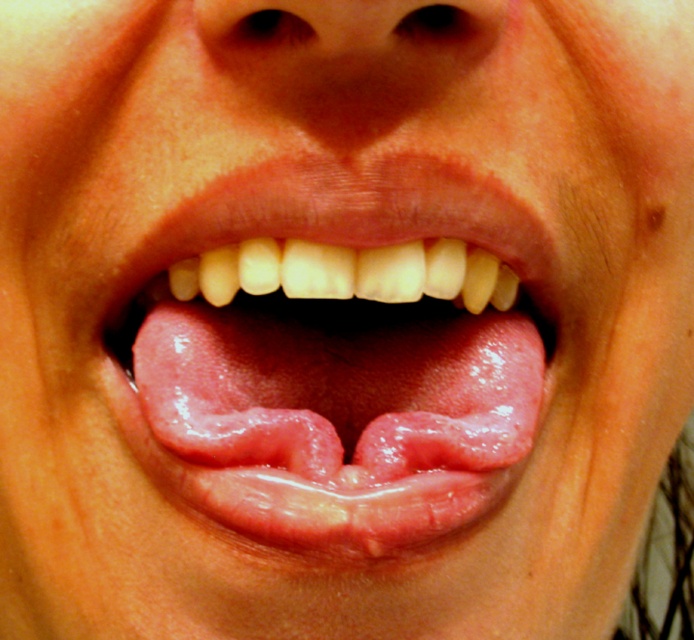
Based on the scene description, which object is positioned lower in the image, the pink flesh tongue at center or the smooth skin at center?

The pink flesh tongue at center is located below smooth skin at center, so the pink flesh tongue at center is positioned lower in the image.

You are a dentist examining a patient. You need to reach a point located at coordinates point [509,396] in the mouth to apply a dental tool. The tool has a maximum reach of 13 inches. Can you safely reach that point with the tool?

The distance of point [509,396] from viewer is 13.48 inches, which exceeds the tool maximum reach of 13 inches. Therefore, the dentist cannot safely reach the point with the tool.

You are a dentist examining a patient. You notice the pink flesh tongue at center and the smooth skin at center. Which one is located to the left?

The pink flesh tongue at center is positioned on the left side of smooth skin at center, so the pink flesh tongue at center is located to the left.